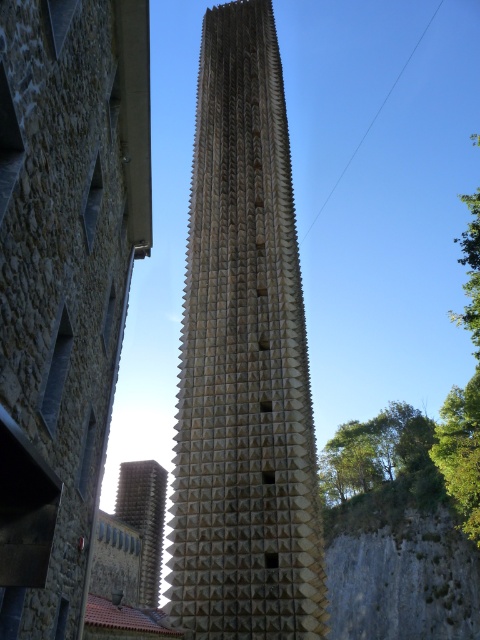
Question: Which object appears farthest from the camera in this image?

Choices:
 (A) golden textured spire at center
 (B) sandy beige textured tower at center

Answer: (A)

Question: Is sandy beige textured tower at center below golden textured spire at center?

Choices:
 (A) yes
 (B) no

Answer: (B)

Question: Is sandy beige textured tower at center smaller than golden textured spire at center?

Choices:
 (A) yes
 (B) no

Answer: (B)

Question: Can you confirm if sandy beige textured tower at center is bigger than golden textured spire at center?

Choices:
 (A) yes
 (B) no

Answer: (A)

Question: Which point is farther to the camera?

Choices:
 (A) sandy beige textured tower at center
 (B) golden textured spire at center

Answer: (B)

Question: Which point is closer to the camera?

Choices:
 (A) (288, 515)
 (B) (141, 493)

Answer: (A)